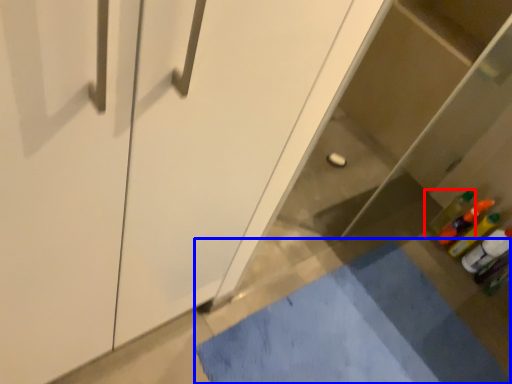
Question: Which of the following is the farthest to the observer, bottle (highlighted by a red box) or bath mat (highlighted by a blue box)?

Choices:
 (A) bottle
 (B) bath mat

Answer: (A)